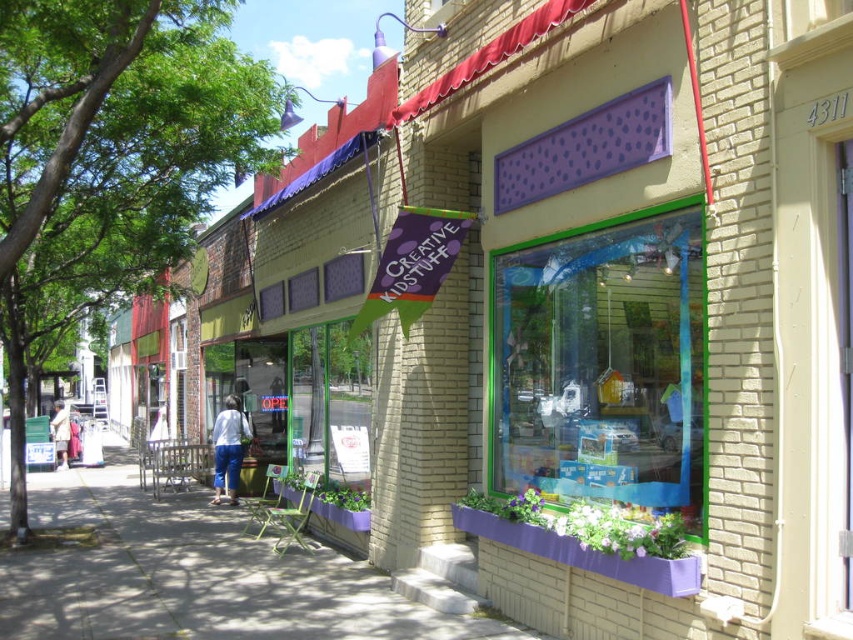
Question: Which object is positioned farthest from the denim jacket at lower left?

Choices:
 (A) smooth concrete sidewalk at lower left
 (B) green leafy tree at left

Answer: (A)

Question: Is green leafy tree at left wider than denim jacket at lower left?

Choices:
 (A) no
 (B) yes

Answer: (B)

Question: Which is farther from the smooth concrete sidewalk at lower left?

Choices:
 (A) green leafy tree at left
 (B) denim pants at center

Answer: (A)

Question: Where is denim pants at center located in relation to denim jacket at lower left in the image?

Choices:
 (A) below
 (B) above

Answer: (B)

Question: Is denim pants at center positioned in front of denim jacket at lower left?

Choices:
 (A) yes
 (B) no

Answer: (A)

Question: Among these points, which one is nearest to the camera?

Choices:
 (A) (196, 0)
 (B) (61, 413)
 (C) (79, 588)
 (D) (216, 445)

Answer: (C)